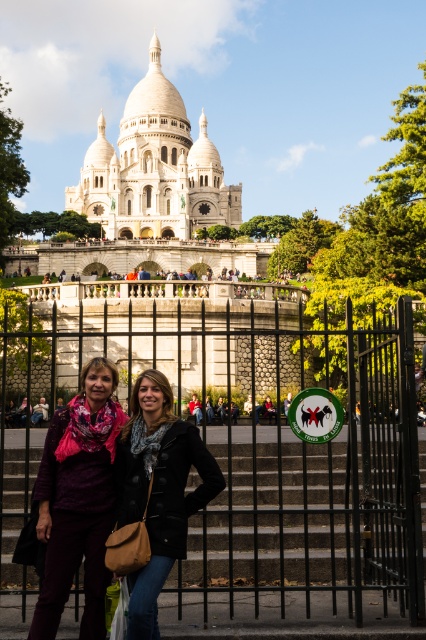
Is matte purple scarf at center wider than black leather jacket at center?

No, matte purple scarf at center is not wider than black leather jacket at center.

Does matte purple scarf at center appear under black leather jacket at center?

Yes, matte purple scarf at center is below black leather jacket at center.

Who is more forward, (66, 483) or (158, 401)?

Point (66, 483) is more forward.

Find the location of a particular element. Image resolution: width=426 pixels, height=640 pixels. matte purple scarf at center is located at coordinates (77, 500).

Which of these two, black wrought iron gate at center or matte purple scarf at center, stands shorter?

matte purple scarf at center

From the picture: Does black wrought iron gate at center come in front of matte purple scarf at center?

No, black wrought iron gate at center is further to the viewer.

Is point (270, 408) farther from camera compared to point (69, 561)?

Yes, point (270, 408) is behind point (69, 561).

Find the location of `black wrought iron gate at center`. black wrought iron gate at center is located at coordinates (265, 435).

Is white stone palace at upper center thinner than matte purple scarf at center?

No, white stone palace at upper center is not thinner than matte purple scarf at center.

Is the position of white stone palace at upper center more distant than that of matte purple scarf at center?

Yes.

The height and width of the screenshot is (640, 426). What are the coordinates of `white stone palace at upper center` in the screenshot? It's located at (154, 168).